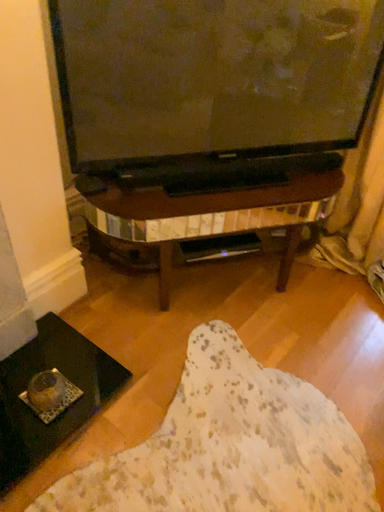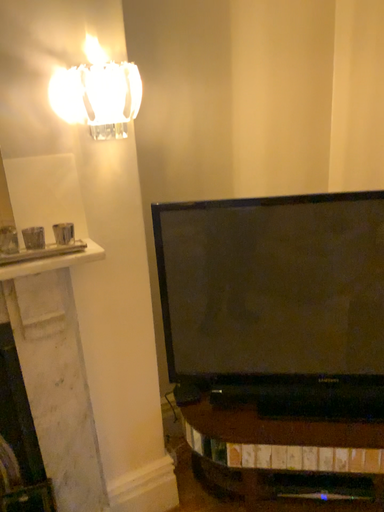
Question: Which way did the camera rotate in the video?

Choices:
 (A) rotated downward
 (B) rotated upward

Answer: (B)